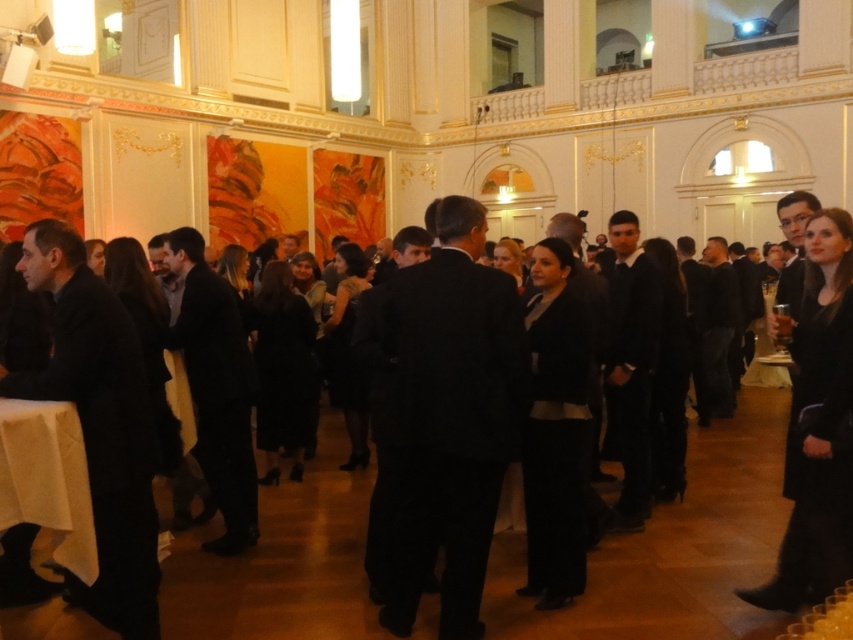
You are a guest at this event and notice two items in the room. One is the black wool coat at right and the other is the white cloth at lower left. Which item takes up more space in the room?

The black wool coat at right is larger in size than the white cloth at lower left, so it takes up more space in the room.

You are organizing a coat check area and need to determine if the black wool coat at right can fit on a hanger that is designed to accommodate items narrower than the white cloth at lower left. Can the coat fit on the hanger?

The black wool coat at right is wider than the white cloth at lower left. Since the hanger is designed for items narrower than the white cloth at lower left, the coat cannot fit on the hanger.

You are at a formal event and need to retrieve your item from the coat check. The coat check attendant tells you your black wool coat at right is hanging behind the white cloth at lower left. Based on the scene description, is this possible?

The white cloth at lower left is behind the black wool coat at right, so the coat check attendant is incorrect because the black wool coat at right is actually in front of the white cloth at lower left, not behind it.